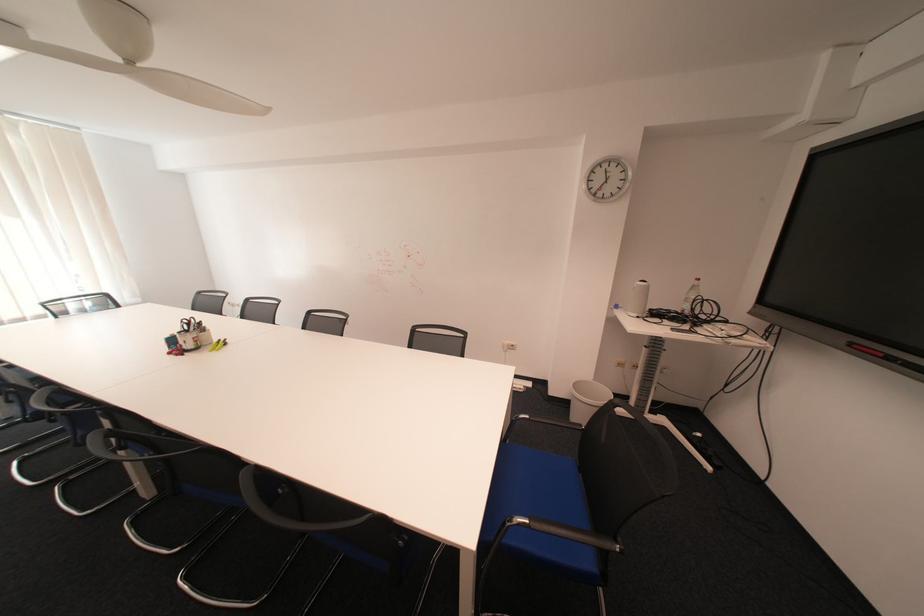
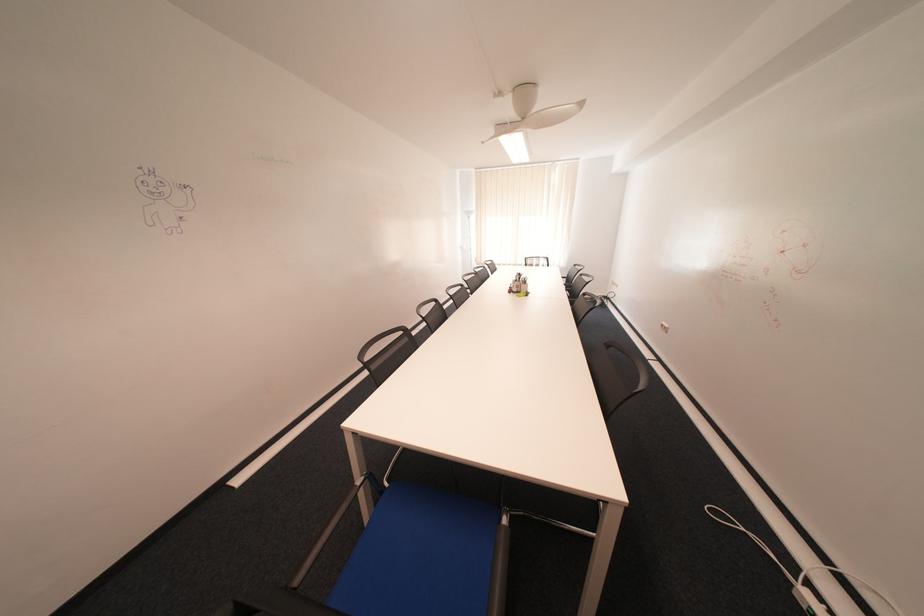
The point at (201, 347) is marked in the first image. Where is the corresponding point in the second image?

(526, 290)